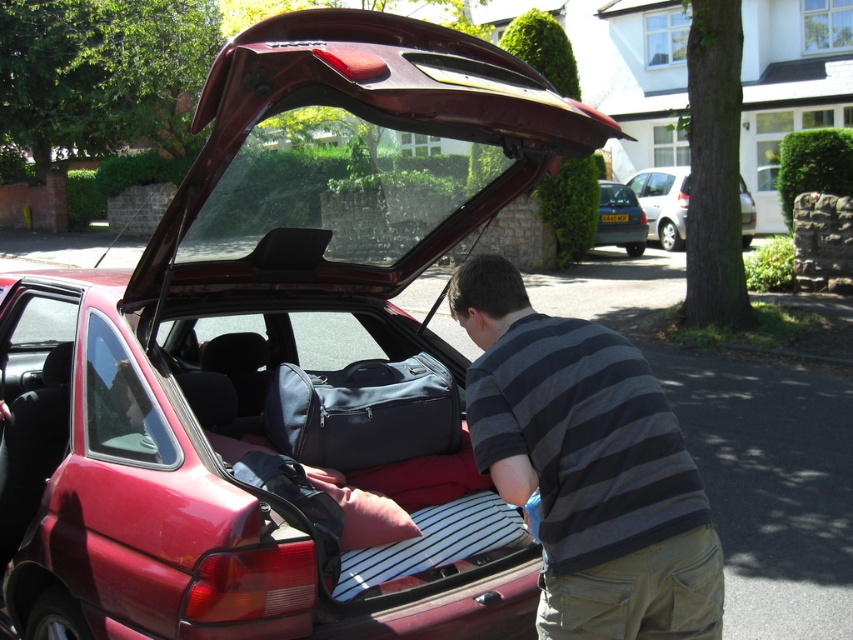
You are a photographer standing 1.5 meters away from the camera position. You want to take a photo of the striped cotton shirt at center without moving the shirt. Can you adjust your position to ensure the shirt is in focus?

The striped cotton shirt at center is 1.90 meters away from the camera. Since you are already 1.5 meters away from the camera position, the total distance between you and the shirt would be 0.4 meters. Most cameras can focus within this range, so yes, you can adjust your position to ensure the shirt is in focus.

You are standing in front of the shiny red car at center and want to take a photo of it with your phone. Your phone can focus on objects up to 3 meters away. Will the car be in focus?

The shiny red car at center is 2.99 meters away from the camera, so yes, the phone can focus on it since it is within the 3 meters range.

You are trying to determine if the shiny red car at center can fit through a low clearance bridge that is exactly the height of the striped cotton shirt at center. Can it pass under the bridge without hitting the top?

The shiny red car at center is shorter than the striped cotton shirt at center, so it can pass under the bridge without hitting the top.